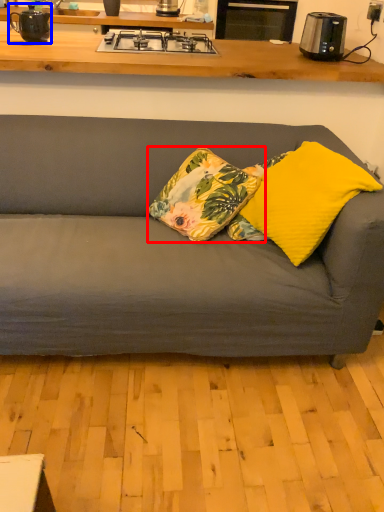
Question: Which of the following is the closest to the observer, pillow (highlighted by a red box) or appliance (highlighted by a blue box)?

Choices:
 (A) pillow
 (B) appliance

Answer: (A)